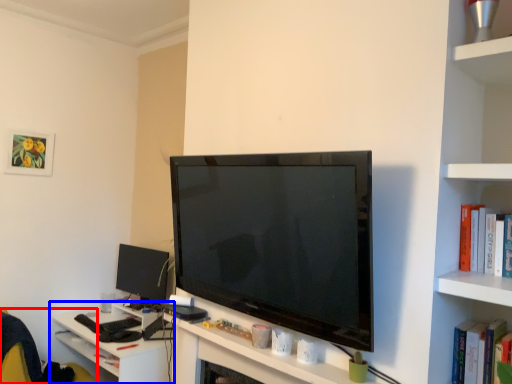
Question: Which object is closer to the camera taking this photo, swivel chair (highlighted by a red box) or table (highlighted by a blue box)?

Choices:
 (A) swivel chair
 (B) table

Answer: (A)